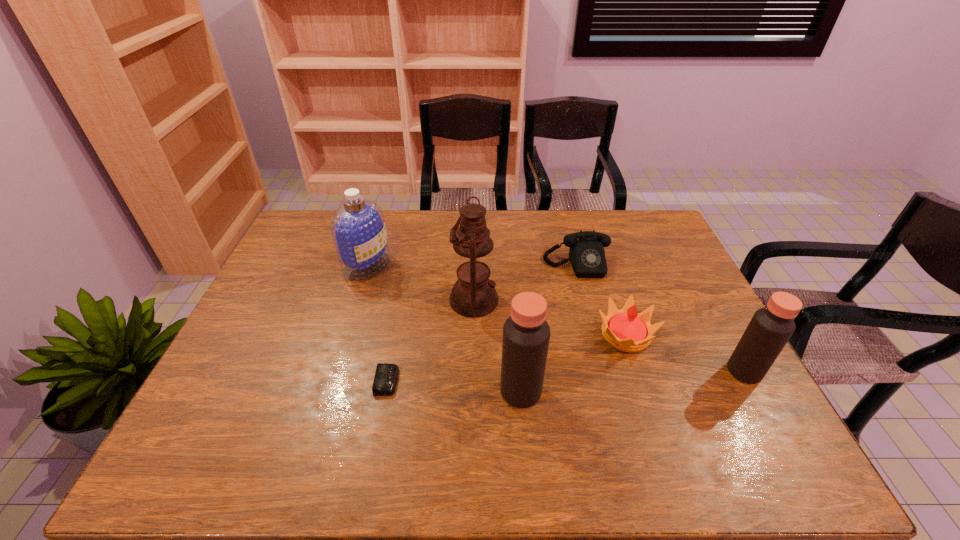
In order to click on vacant place for an extra vinegar on the left in this screenshot , I will do `click(277, 413)`.